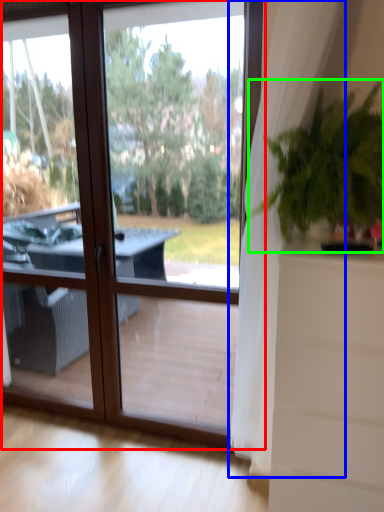
Question: Which is nearer to the window (highlighted by a red box)? curtain (highlighted by a blue box) or houseplant (highlighted by a green box).

Choices:
 (A) curtain
 (B) houseplant

Answer: (A)